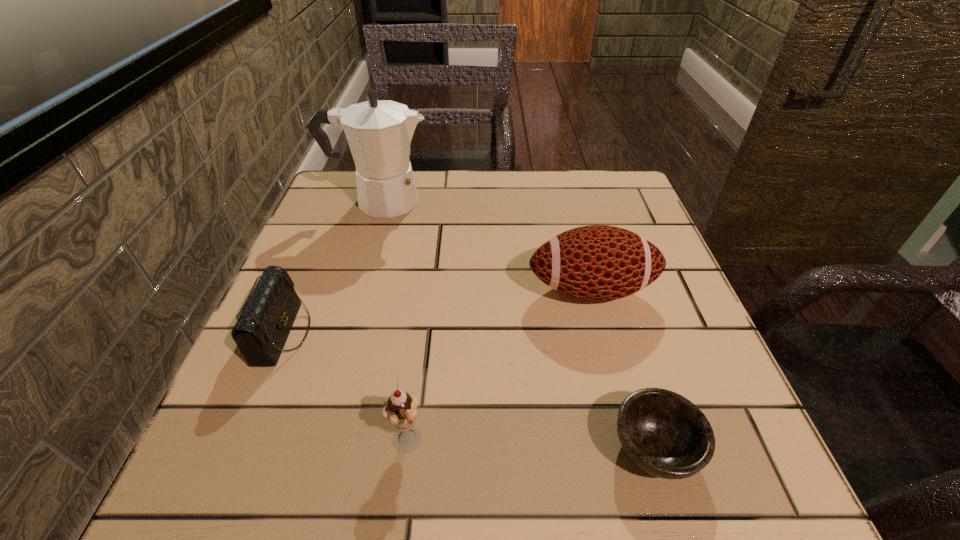
You are a GUI agent. You are given a task and a screenshot of the screen. Output one action in this format:
    pyautogui.click(x=<x>, y=<y>)
    Task: Click on the vacant space located 0.390m on the back of the bowl
    This screenshot has height=540, width=960.
    Given the screenshot: What is the action you would take?
    pyautogui.click(x=594, y=245)

You are a GUI agent. You are given a task and a screenshot of the screen. Output one action in this format:
    pyautogui.click(x=<x>, y=<y>)
    Task: Click on the object present at the far edge
    The image size is (960, 540).
    Given the screenshot: What is the action you would take?
    pyautogui.click(x=379, y=132)

Find the location of a particular element. This screenshot has width=960, height=540. icecream present at the near edge is located at coordinates coord(401,409).

Where is `bowl that is at the near edge`? Image resolution: width=960 pixels, height=540 pixels. bowl that is at the near edge is located at coordinates (665, 434).

This screenshot has width=960, height=540. Identify the location of coffeepot that is at the left edge. (379, 132).

Identify the location of clutch bag present at the left edge. The image size is (960, 540). (266, 318).

Where is `football that is at the right edge`? The width and height of the screenshot is (960, 540). football that is at the right edge is located at coordinates (598, 262).

Locate an element on the screen. The image size is (960, 540). bowl located in the right edge section of the desktop is located at coordinates (665, 434).

This screenshot has height=540, width=960. Find the location of `object at the far left corner`. object at the far left corner is located at coordinates (379, 132).

The width and height of the screenshot is (960, 540). I want to click on object present at the near right corner, so click(665, 434).